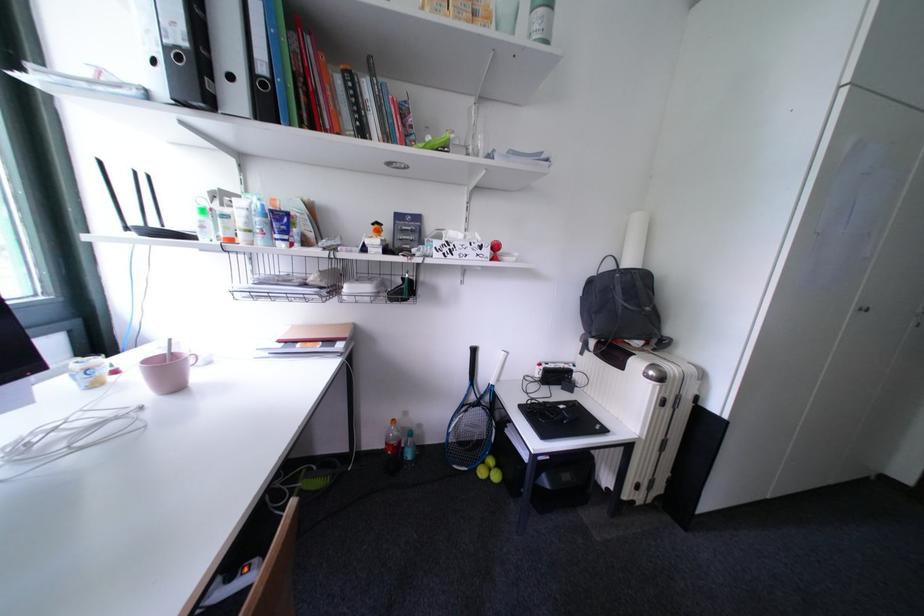
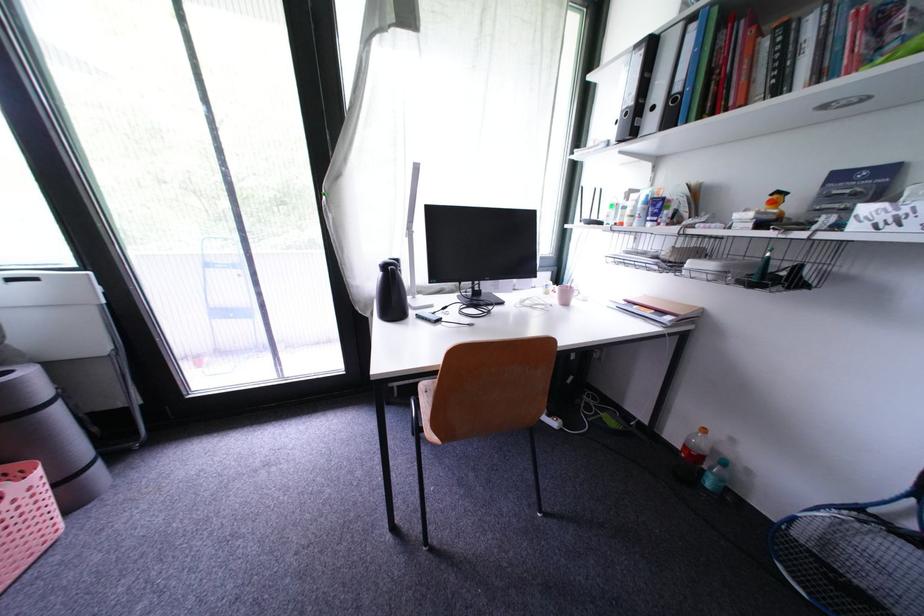
In the second image, find the point that corresponds to point 385,233 in the first image.

(782, 206)